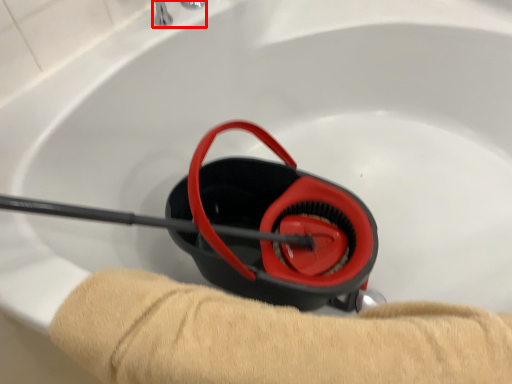
Question: From the image, what is the correct spatial relationship of faucet (annotated by the red box) in relation to tan?

Choices:
 (A) right
 (B) left

Answer: (B)